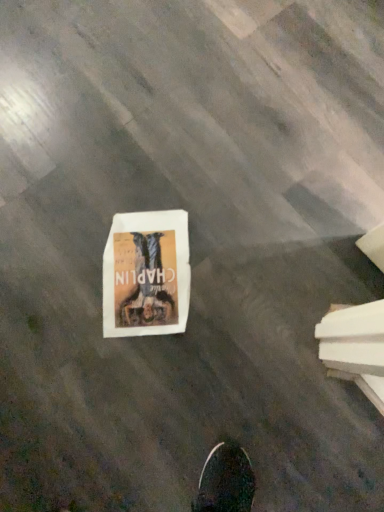
Where is `free space to the left of white paper comic book at center`? The image size is (384, 512). free space to the left of white paper comic book at center is located at coordinates (51, 270).